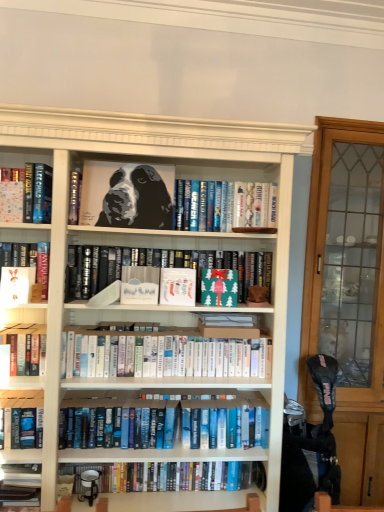
Question: Does white matte paper at center, which is the third paperback book from left to right, appear on the left side of black glossy painting of a dog at center?

Choices:
 (A) no
 (B) yes

Answer: (A)

Question: Is white matte paper at center, which is the third paperback book from left to right, far away from black glossy painting of a dog at center?

Choices:
 (A) no
 (B) yes

Answer: (A)

Question: Considering the relative sizes of white matte paper at center, the 3th paperback book positioned from the right, and black glossy painting of a dog at center in the image provided, is white matte paper at center, the 3th paperback book positioned from the right, taller than black glossy painting of a dog at center?

Choices:
 (A) no
 (B) yes

Answer: (A)

Question: From a real-world perspective, is white matte paper at center, which is the third paperback book from left to right, over black glossy painting of a dog at center?

Choices:
 (A) no
 (B) yes

Answer: (A)

Question: Could black glossy painting of a dog at center be considered to be inside white matte paper at center, which is the third paperback book from left to right?

Choices:
 (A) yes
 (B) no

Answer: (B)

Question: From a real-world perspective, is clear glass cabinet at right physically located above or below blue hardcover books at lower center, acting as the seventh book starting from the top?

Choices:
 (A) below
 (B) above

Answer: (B)

Question: Does point (306, 391) appear closer or farther from the camera than point (251, 474)?

Choices:
 (A) farther
 (B) closer

Answer: (A)

Question: Considering their positions, is clear glass cabinet at right located in front of or behind blue hardcover books at lower center, acting as the seventh book starting from the top?

Choices:
 (A) front
 (B) behind

Answer: (B)

Question: Visually, is clear glass cabinet at right positioned to the left or to the right of blue hardcover books at lower center, acting as the seventh book starting from the top?

Choices:
 (A) right
 (B) left

Answer: (A)

Question: Considering the positions of white matte paper at left, the 4th paperback book in the right-to-left sequence, and hardcover book at left, which is the second book from top to bottom, in the image, is white matte paper at left, the 4th paperback book in the right-to-left sequence, taller or shorter than hardcover book at left, which is the second book from top to bottom,?

Choices:
 (A) tall
 (B) short

Answer: (B)

Question: From a real-world perspective, relative to hardcover book at left, which is the second book from top to bottom, is white matte paper at left, the 4th paperback book in the right-to-left sequence, vertically above or below?

Choices:
 (A) above
 (B) below

Answer: (B)

Question: Does point (19, 280) appear closer or farther from the camera than point (46, 177)?

Choices:
 (A) farther
 (B) closer

Answer: (A)

Question: Considering the relative positions of white matte paper at left, the 4th paperback book in the right-to-left sequence, and hardcover book at left, which is the second book from top to bottom, in the image provided, is white matte paper at left, the 4th paperback book in the right-to-left sequence, to the left or to the right of hardcover book at left, which is the second book from top to bottom,?

Choices:
 (A) right
 (B) left

Answer: (B)

Question: Based on their sizes in the image, would you say white paperbacks at center, which is the fourth book from top to bottom, is bigger or smaller than matte black book at center, placed as the 3th book when sorted from top to bottom?

Choices:
 (A) big
 (B) small

Answer: (A)

Question: Is white paperbacks at center, the 4th book positioned from the bottom, wider or thinner than matte black book at center, the 5th book in the bottom-to-top sequence?

Choices:
 (A) wide
 (B) thin

Answer: (A)